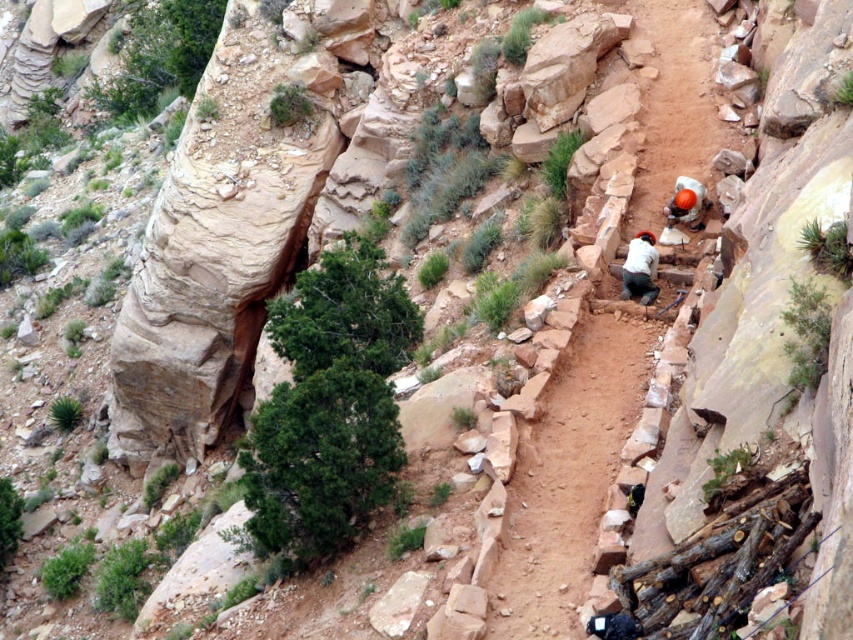
Which is behind, point (592, 550) or point (653, 289)?

Point (653, 289)

Between point (659, 115) and point (643, 246), which one is positioned in front?

Positioned in front is point (643, 246).

This screenshot has width=853, height=640. I want to click on dirt trail at center, so click(x=569, y=476).

Locate an element on the screen. This screenshot has width=853, height=640. white fabric shirt at center is located at coordinates (640, 268).

The image size is (853, 640). What do you see at coordinates (569, 476) in the screenshot? I see `dirt trail at center` at bounding box center [569, 476].

Can you confirm if dirt trail at center is wider than orange helmet at upper right?

Yes.

Does point (595, 477) lie in front of point (689, 221)?

Yes, it is in front of point (689, 221).

At what (x,y) coordinates should I click in order to perform the action: click on dirt trail at center. Please return your answer as a coordinate pair (x, y). Looking at the image, I should click on (569, 476).